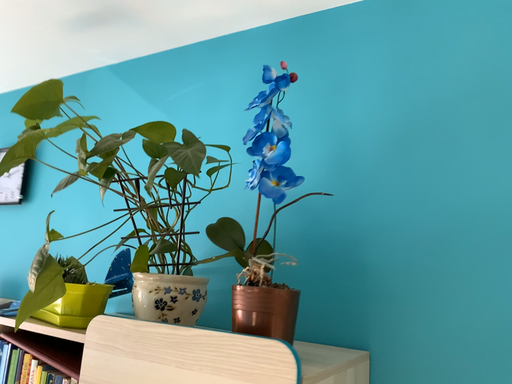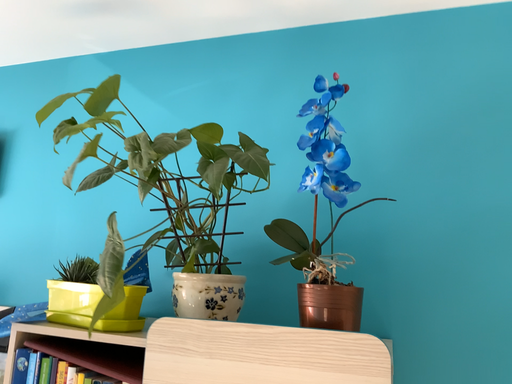
Question: Which way did the camera rotate in the video?

Choices:
 (A) rotated right
 (B) rotated left

Answer: (A)